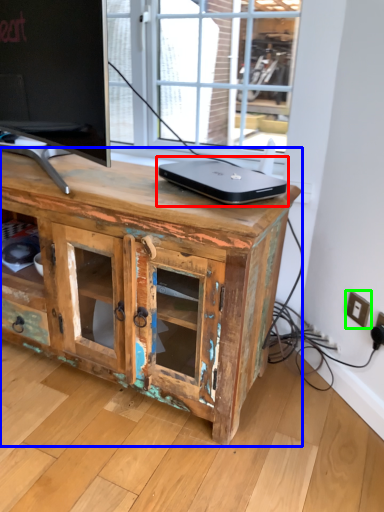
Question: Estimate the real-world distances between objects in this image. Which object is farther from laptop (highlighted by a red box), chest of drawers (highlighted by a blue box) or electric outlet (highlighted by a green box)?

Choices:
 (A) chest of drawers
 (B) electric outlet

Answer: (B)